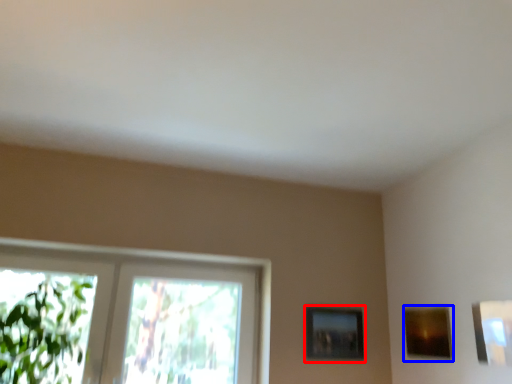
Question: Which object is further to the camera taking this photo, picture frame (highlighted by a red box) or picture frame (highlighted by a blue box)?

Choices:
 (A) picture frame
 (B) picture frame

Answer: (A)